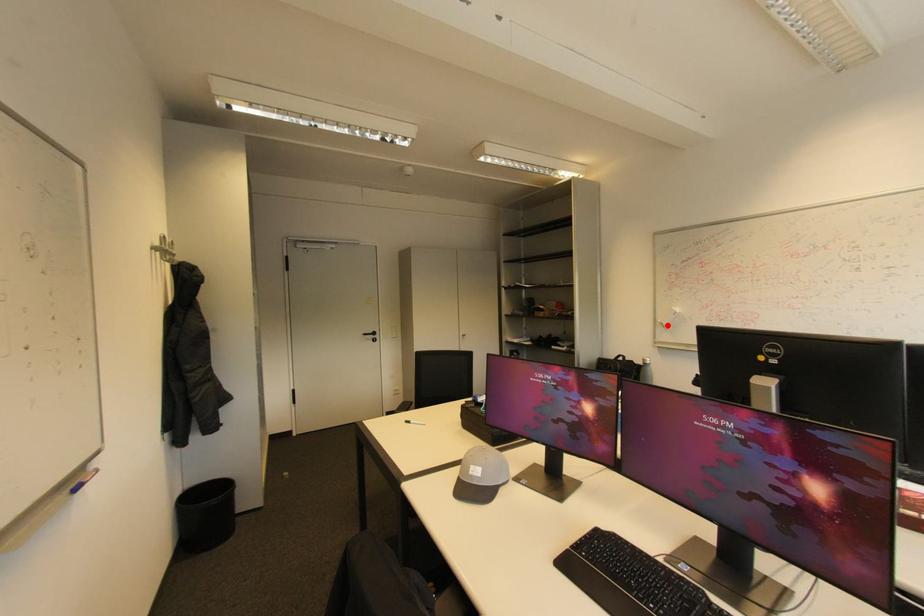
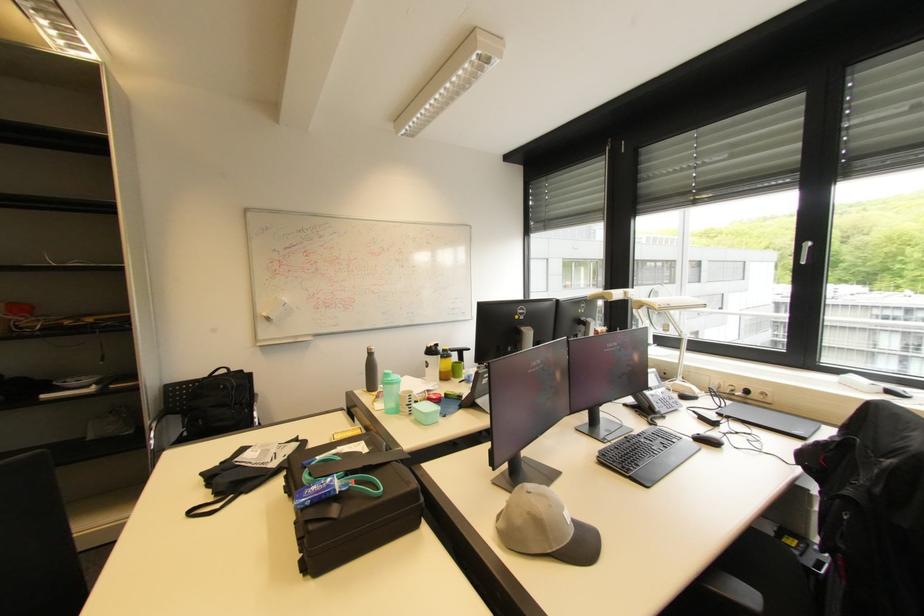
Find the pixel in the second image that matches the highlighted location in the first image.

(273, 320)